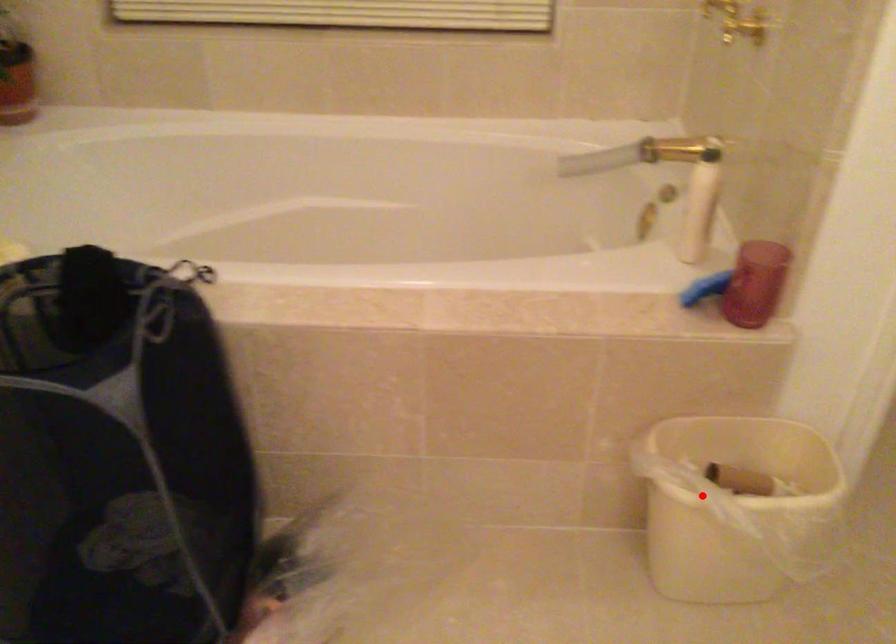
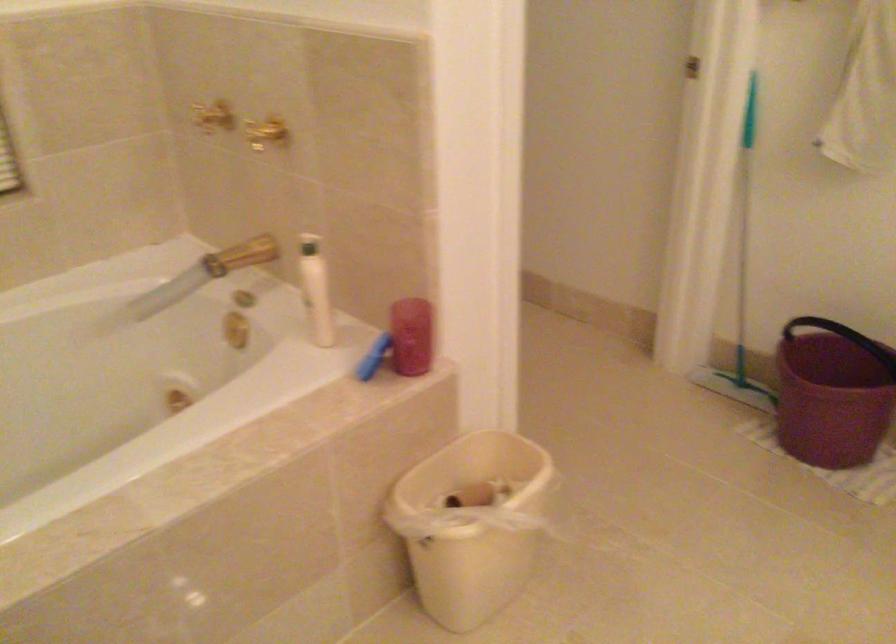
In the second image, find the point that corresponds to the highlighted location in the first image.

(471, 524)